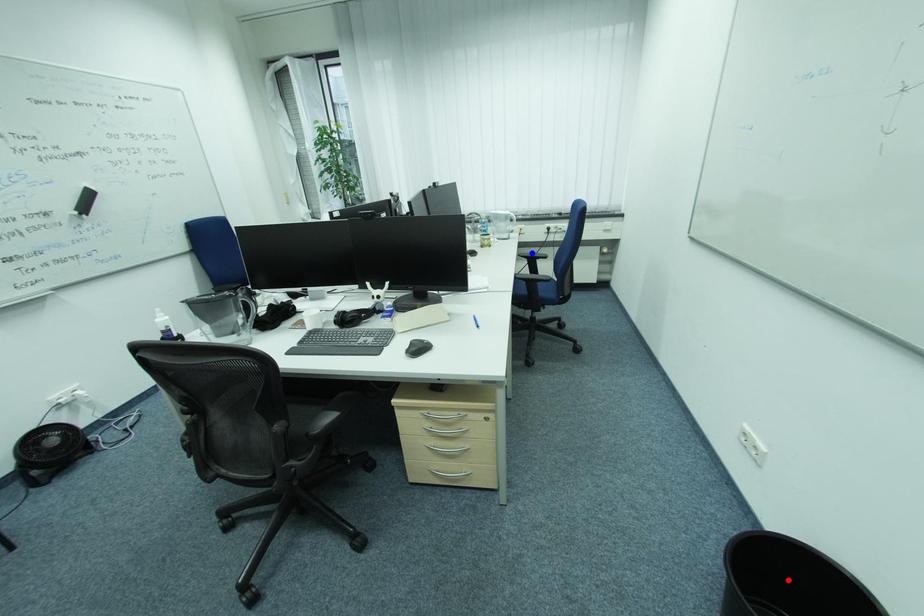
Question: In the image, two points are highlighted. Which point is nearer to the camera? Reply with the corresponding letter.

Choices:
 (A) blue point
 (B) red point

Answer: (B)